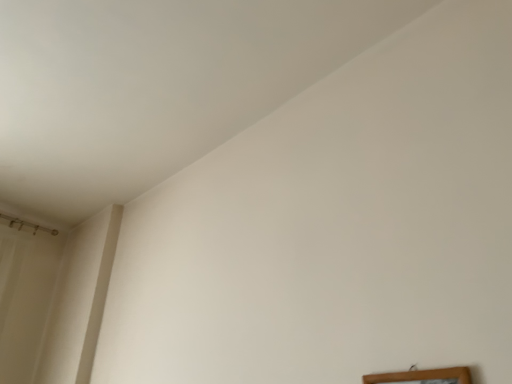
What is the approximate width of wooden frame at lower right?

1.06 inches.

Locate an element on the screen. This screenshot has height=384, width=512. wooden frame at lower right is located at coordinates (422, 376).

What do you see at coordinates (422, 376) in the screenshot?
I see `wooden frame at lower right` at bounding box center [422, 376].

I want to click on wooden frame at lower right, so [x=422, y=376].